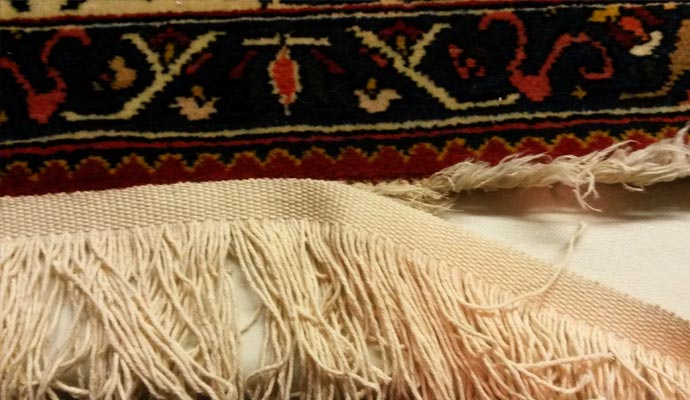
Identify the location of rug. This screenshot has height=400, width=690. (310, 87).